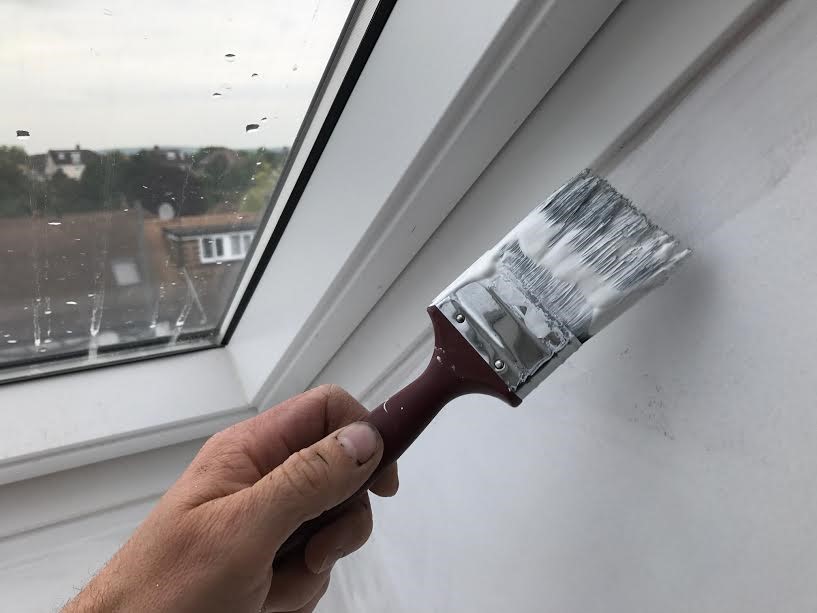
Identify the location of wall. (728, 284).